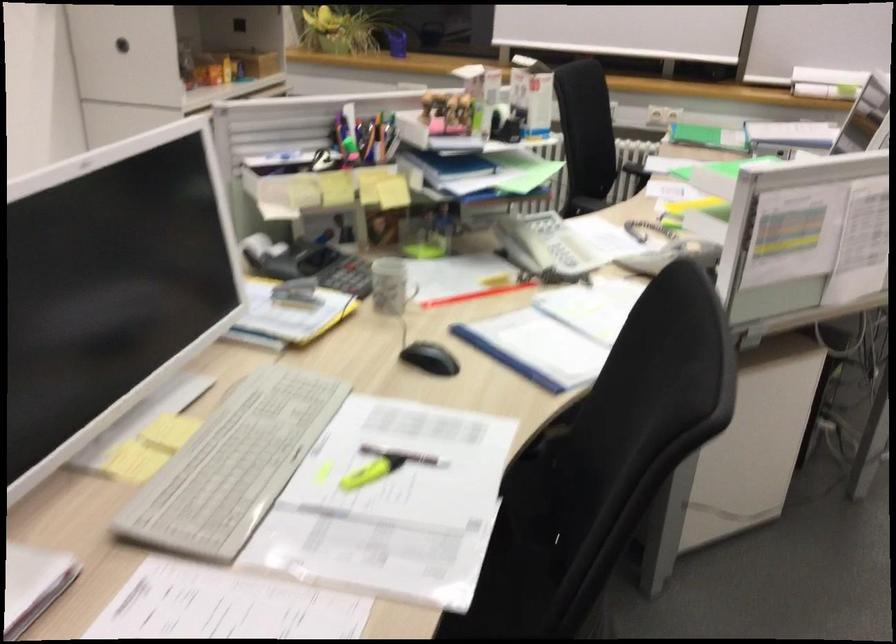
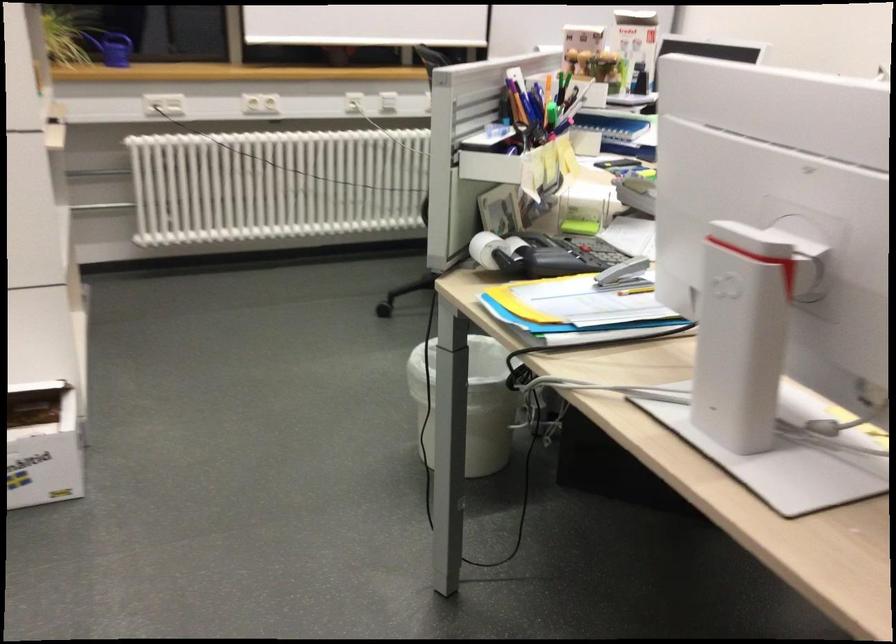
Question: I am providing you with two images of the same scene from different viewpoints. Which of the following objects are not visible in image2?

Choices:
 (A) yellow paper folder
 (B) red apple pushpin
 (C) yellow pencil
 (D) patterned mug

Answer: (D)